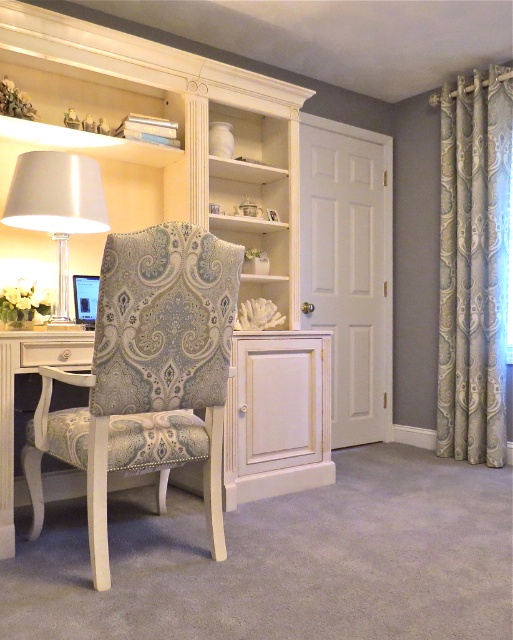
Is silky beige curtain at right bigger than matte white desk at center?

No, silky beige curtain at right is not bigger than matte white desk at center.

Is silky beige curtain at right in front of matte white desk at center?

No.

Is point (476, 232) in front of point (249, 394)?

No, it is not.

This screenshot has height=640, width=513. Identify the location of silky beige curtain at right. (473, 266).

Does silky beige curtain at right have a lesser width compared to satin silver lampshade at left?

Yes, silky beige curtain at right is thinner than satin silver lampshade at left.

Does silky beige curtain at right appear under satin silver lampshade at left?

No, silky beige curtain at right is not below satin silver lampshade at left.

Describe the element at coordinates (473, 266) in the screenshot. The image size is (513, 640). I see `silky beige curtain at right` at that location.

Find the location of `silky beige curtain at right`. silky beige curtain at right is located at coordinates (473, 266).

Who is more forward, (226, 504) or (29, 195)?

Point (29, 195)

Which is behind, point (17, 348) or point (83, 166)?

Point (83, 166)

Locate an element on the screen. The width and height of the screenshot is (513, 640). matte white desk at center is located at coordinates (278, 416).